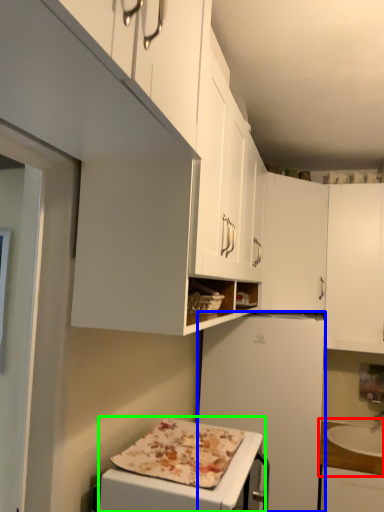
Question: Based on their relative distances, which object is farther from countertop (highlighted by a red box)? Choose from refrigerator (highlighted by a blue box) and appliance (highlighted by a green box).

Choices:
 (A) refrigerator
 (B) appliance

Answer: (B)